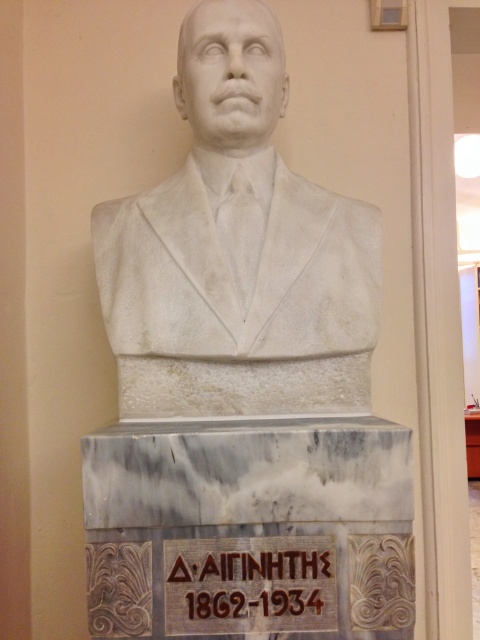
Can you confirm if white marble bust at center is shorter than carved stone plaque at center?

No.

Between white marble bust at center and carved stone plaque at center, which one appears on the right side from the viewer's perspective?

From the viewer's perspective, carved stone plaque at center appears more on the right side.

What do you see at coordinates (237, 252) in the screenshot? I see `white marble bust at center` at bounding box center [237, 252].

Locate an element on the screen. Image resolution: width=480 pixels, height=640 pixels. white marble bust at center is located at coordinates (237, 252).